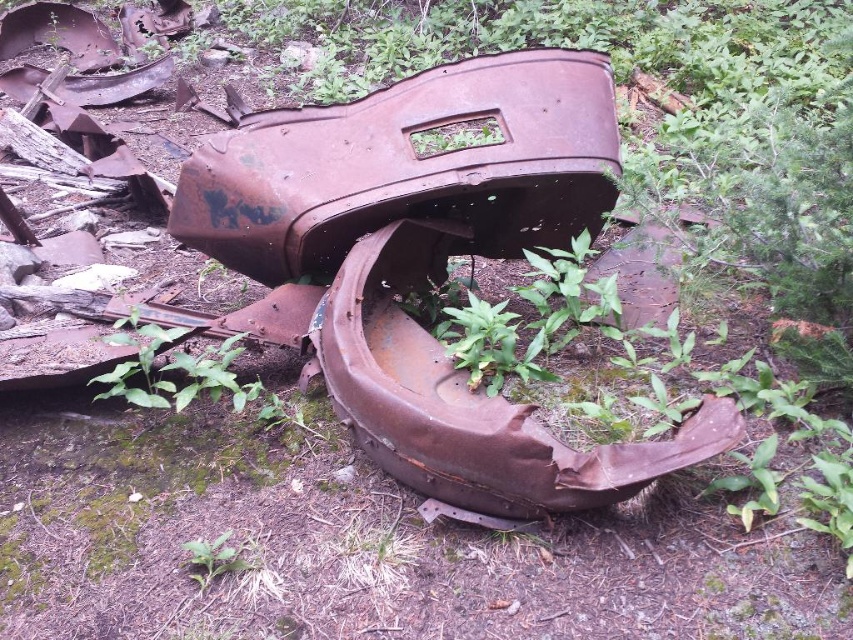
Question: Which point is closer to the camera?

Choices:
 (A) click(x=415, y=273)
 (B) click(x=238, y=556)

Answer: (B)

Question: In this image, where is rusty metal car at center located relative to green leafy weed at lower center?

Choices:
 (A) above
 (B) below

Answer: (A)

Question: Is rusty metal car at center above green leafy weed at lower center?

Choices:
 (A) yes
 (B) no

Answer: (A)

Question: Is rusty metal car at center thinner than green leafy weed at lower center?

Choices:
 (A) no
 (B) yes

Answer: (A)

Question: Which point appears closest to the camera in this image?

Choices:
 (A) (202, 584)
 (B) (585, 109)

Answer: (A)